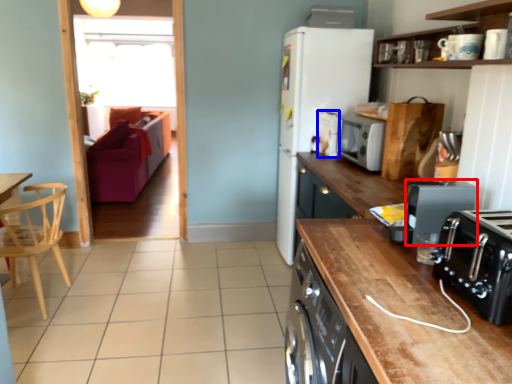
Question: Which object is closer to the camera taking this photo, kitchen appliance (highlighted by a red box) or appliance (highlighted by a blue box)?

Choices:
 (A) kitchen appliance
 (B) appliance

Answer: (A)